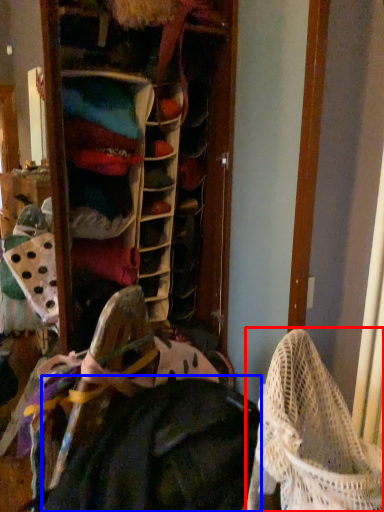
Question: Which of the following is the closest to the observer, baby carriage (highlighted by a red box) or clothing (highlighted by a blue box)?

Choices:
 (A) baby carriage
 (B) clothing

Answer: (A)